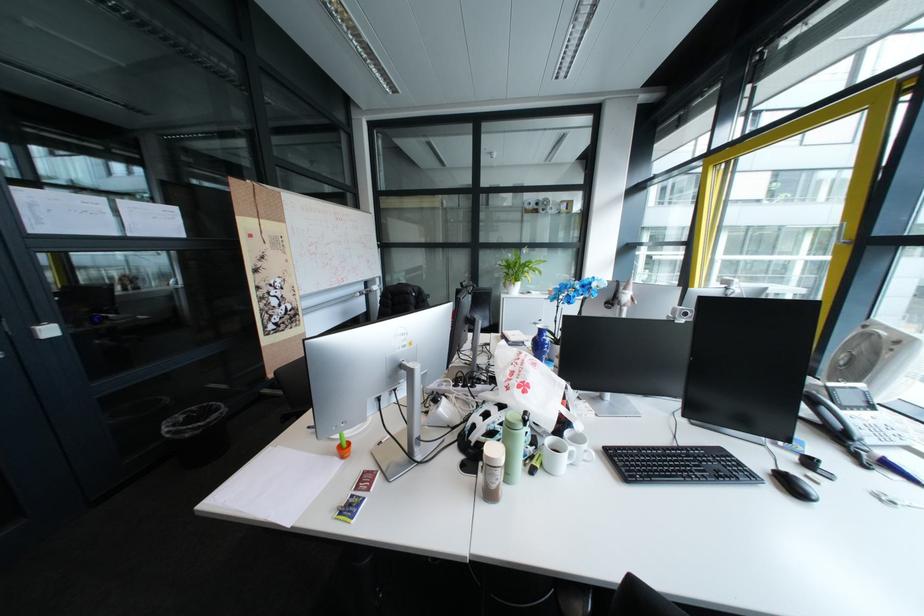
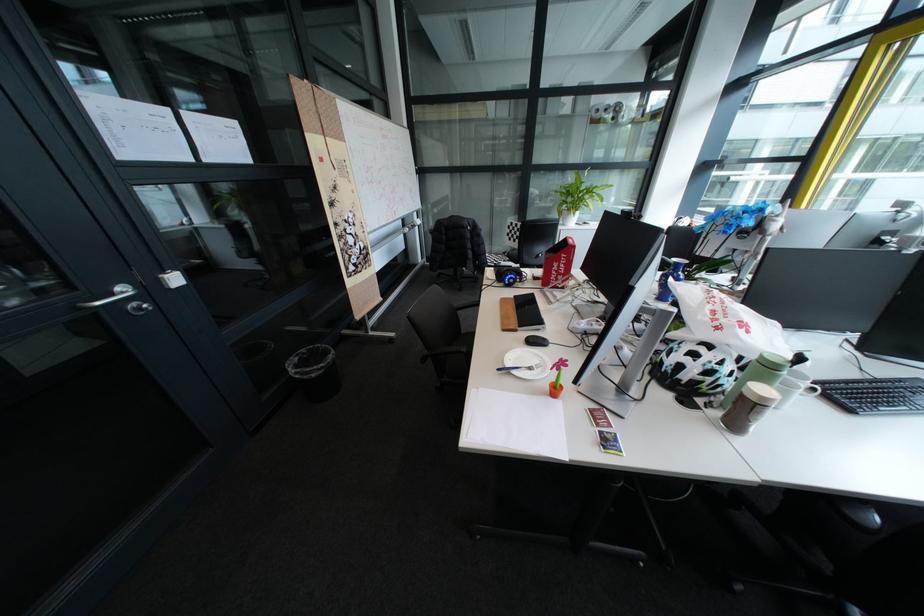
Find the pixel in the second image that matches point (208, 408) in the first image.

(317, 351)